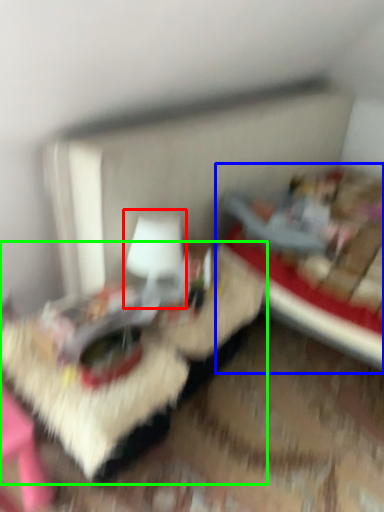
Question: Based on their relative distances, which object is farther from table lamp (highlighted by a red box)? Choose from bed (highlighted by a blue box) and table (highlighted by a green box).

Choices:
 (A) bed
 (B) table

Answer: (A)